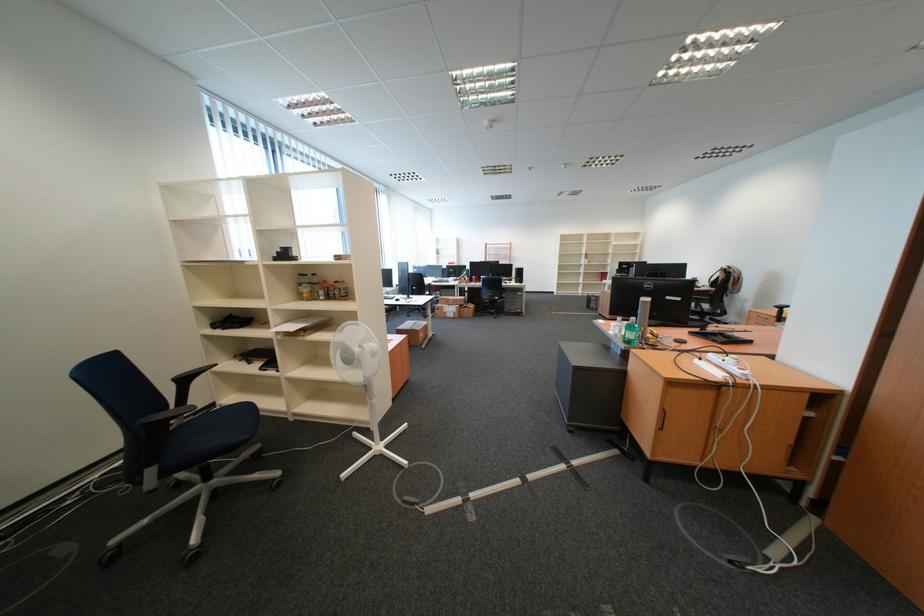
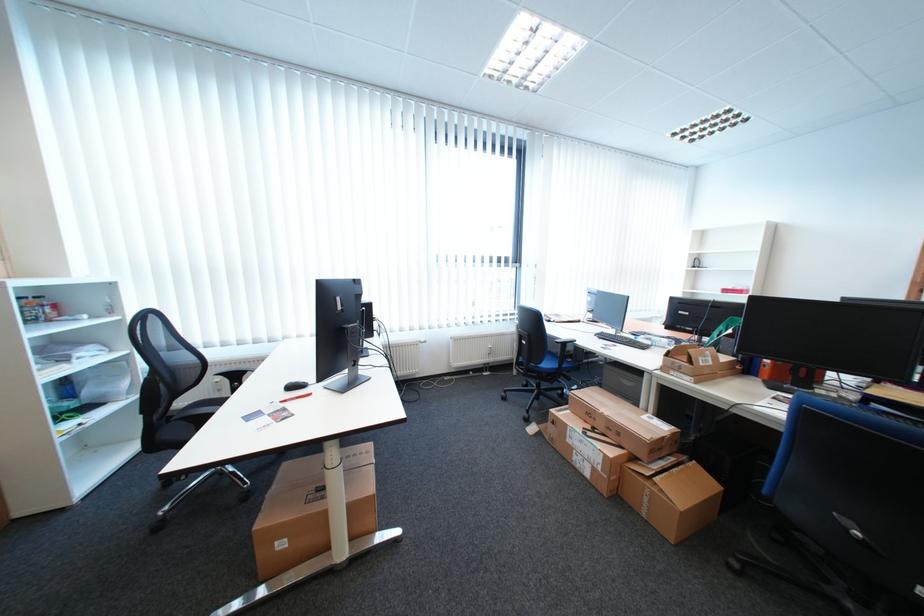
In the second image, find the point that corresponds to point 478,313 in the first image.

(658, 499)